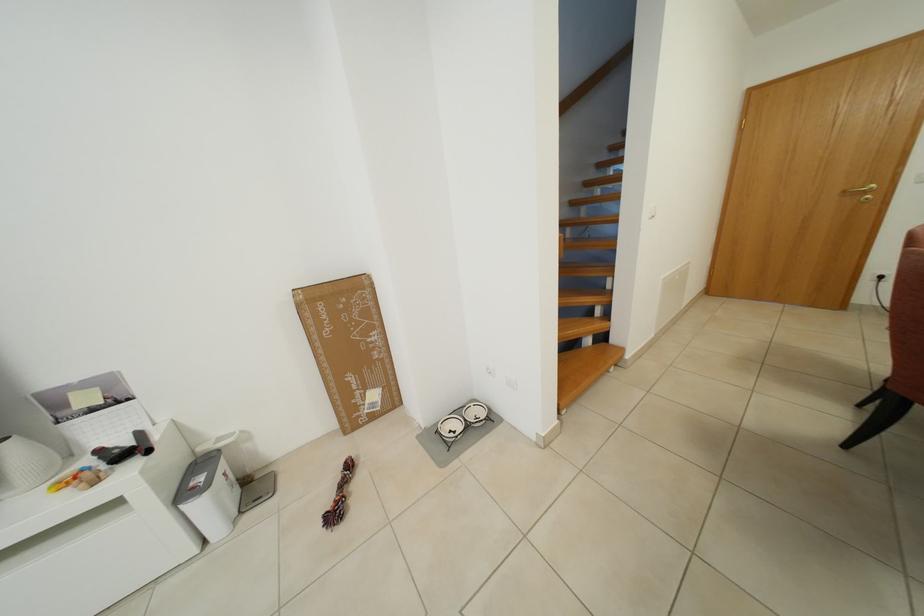
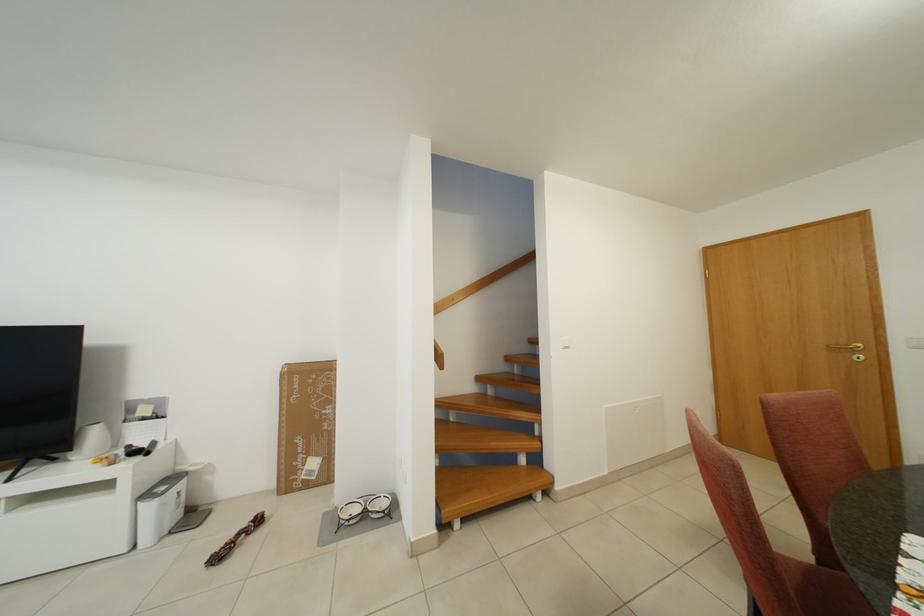
The point at (x=382, y=400) is marked in the first image. Where is the corresponding point in the second image?

(322, 468)